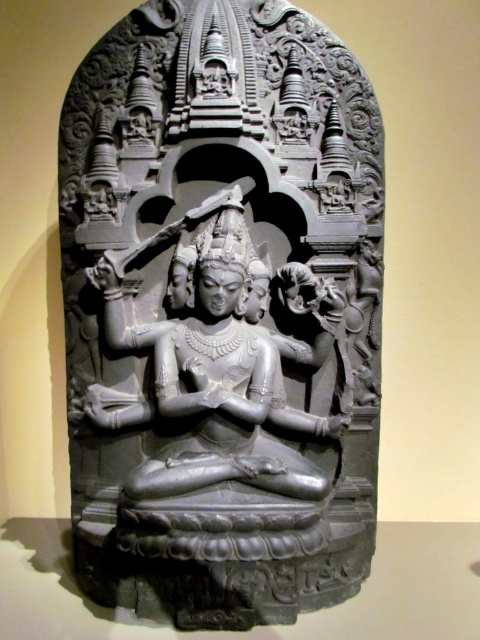
Question: Does black stone statue at center appear under gray stone statue at center?

Choices:
 (A) yes
 (B) no

Answer: (B)

Question: Does black stone statue at center appear on the right side of gray stone statue at center?

Choices:
 (A) yes
 (B) no

Answer: (A)

Question: Which of the following is the closest to the observer?

Choices:
 (A) (308, 477)
 (B) (310, 476)

Answer: (A)

Question: Among these objects, which one is farthest from the camera?

Choices:
 (A) black stone statue at center
 (B) gray stone statue at center

Answer: (B)

Question: Does black stone statue at center appear under gray stone statue at center?

Choices:
 (A) no
 (B) yes

Answer: (A)